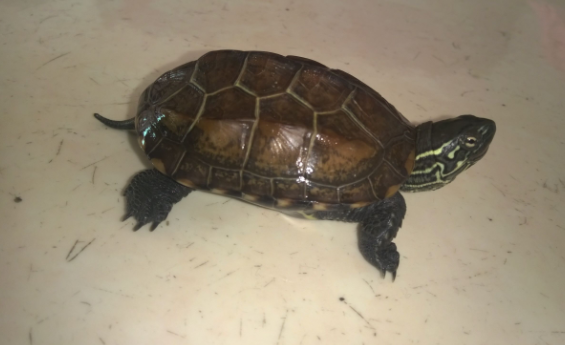
Identify the location of right front leg. (380, 247).